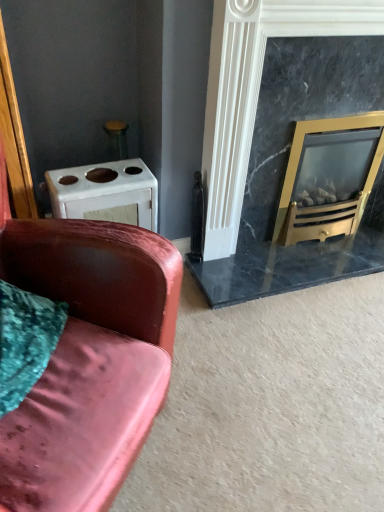
Question: From a real-world perspective, is gold metallic wood burning stove at right positioned under white matte oven at upper left based on gravity?

Choices:
 (A) no
 (B) yes

Answer: (A)

Question: From the image's perspective, is gold metallic wood burning stove at right above white matte oven at upper left?

Choices:
 (A) yes
 (B) no

Answer: (A)

Question: Does gold metallic wood burning stove at right have a greater width compared to white matte oven at upper left?

Choices:
 (A) no
 (B) yes

Answer: (B)

Question: Does gold metallic wood burning stove at right have a lesser width compared to white matte oven at upper left?

Choices:
 (A) yes
 (B) no

Answer: (B)

Question: Is gold metallic wood burning stove at right in front of white matte oven at upper left?

Choices:
 (A) no
 (B) yes

Answer: (A)

Question: From a real-world perspective, is marble fireplace at right physically located above or below white matte oven at upper left?

Choices:
 (A) below
 (B) above

Answer: (B)

Question: Looking at the image, does marble fireplace at right seem bigger or smaller compared to white matte oven at upper left?

Choices:
 (A) small
 (B) big

Answer: (B)

Question: Based on their positions, is marble fireplace at right located to the left or right of white matte oven at upper left?

Choices:
 (A) left
 (B) right

Answer: (B)

Question: Considering the positions of marble fireplace at right and white matte oven at upper left in the image, is marble fireplace at right wider or thinner than white matte oven at upper left?

Choices:
 (A) thin
 (B) wide

Answer: (A)

Question: In the image, is gold metallic wood burning stove at right positioned in front of or behind marble fireplace at right?

Choices:
 (A) front
 (B) behind

Answer: (B)

Question: Considering the positions of gold metallic wood burning stove at right and marble fireplace at right in the image, is gold metallic wood burning stove at right taller or shorter than marble fireplace at right?

Choices:
 (A) short
 (B) tall

Answer: (A)

Question: Looking at their shapes, would you say gold metallic wood burning stove at right is wider or thinner than marble fireplace at right?

Choices:
 (A) wide
 (B) thin

Answer: (A)

Question: From the image's perspective, is gold metallic wood burning stove at right above or below marble fireplace at right?

Choices:
 (A) below
 (B) above

Answer: (A)

Question: Is marble fireplace at right in front of or behind velvet pink couch at left in the image?

Choices:
 (A) behind
 (B) front

Answer: (A)

Question: Considering the positions of marble fireplace at right and velvet pink couch at left in the image, is marble fireplace at right taller or shorter than velvet pink couch at left?

Choices:
 (A) tall
 (B) short

Answer: (A)